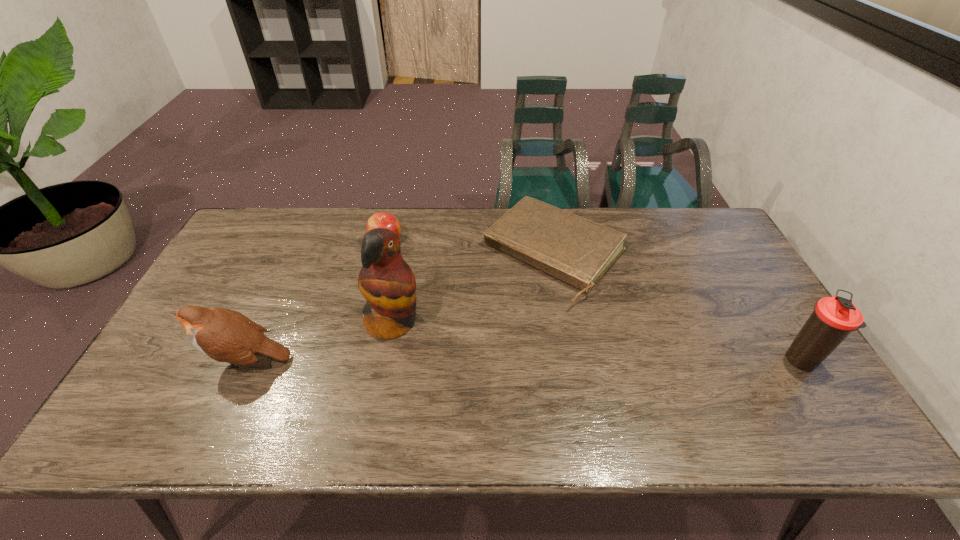
The height and width of the screenshot is (540, 960). In order to click on free space located 0.250m on the back of the rightmost object in this screenshot , I will do `click(750, 278)`.

You are a GUI agent. You are given a task and a screenshot of the screen. Output one action in this format:
    pyautogui.click(x=<x>, y=<y>)
    Task: Click on the free space located 0.180m on the face of the tallest object
    The height and width of the screenshot is (540, 960).
    Given the screenshot: What is the action you would take?
    pyautogui.click(x=472, y=363)

Where is `vacant space located on the face of the tallest object`? vacant space located on the face of the tallest object is located at coordinates (486, 370).

Find the location of a particular element. free region located 0.360m on the face of the tallest object is located at coordinates (537, 396).

You are a GUI agent. You are given a task and a screenshot of the screen. Output one action in this format:
    pyautogui.click(x=<x>, y=<y>)
    Task: Click on the vacant space situated 0.250m on the stem of the second shortest object
    
    Given the screenshot: What is the action you would take?
    pyautogui.click(x=416, y=303)

The width and height of the screenshot is (960, 540). In order to click on vacant area located 0.360m on the stem of the second shortest object in this screenshot , I will do `click(428, 331)`.

This screenshot has width=960, height=540. I want to click on free space located on the stem of the second shortest object, so click(x=405, y=281).

You are a GUI agent. You are given a task and a screenshot of the screen. Output one action in this format:
    pyautogui.click(x=<x>, y=<y>)
    Task: Click on the free space located 0.330m on the spine side of the shortest object
    This screenshot has height=540, width=960.
    Given the screenshot: What is the action you would take?
    pyautogui.click(x=443, y=379)

I want to click on free point located on the spine side of the shortest object, so click(x=472, y=347).

This screenshot has width=960, height=540. In order to click on blank space located 0.200m on the spine side of the shortest object in this screenshot , I will do (474, 345).